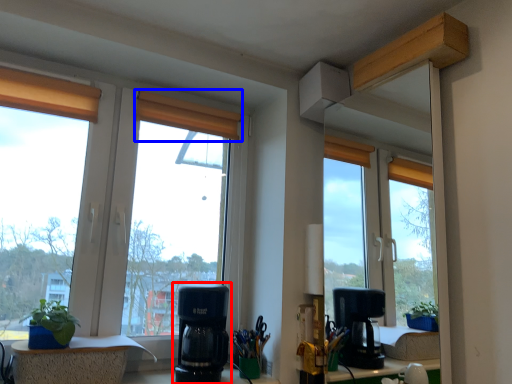
Question: Which point is closer to the camera, coffee maker (highlighted by a red box) or curtain (highlighted by a blue box)?

Choices:
 (A) coffee maker
 (B) curtain

Answer: (A)